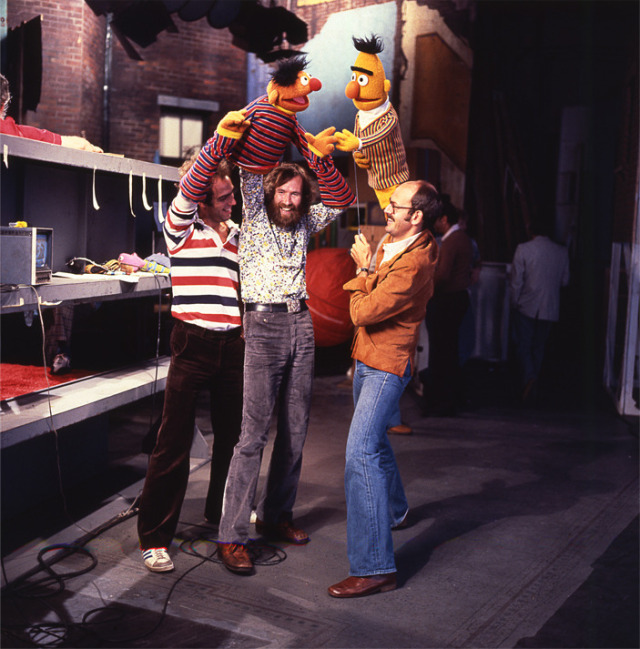
Identify the location of brick walls. The width and height of the screenshot is (640, 649). (153, 69), (79, 56).